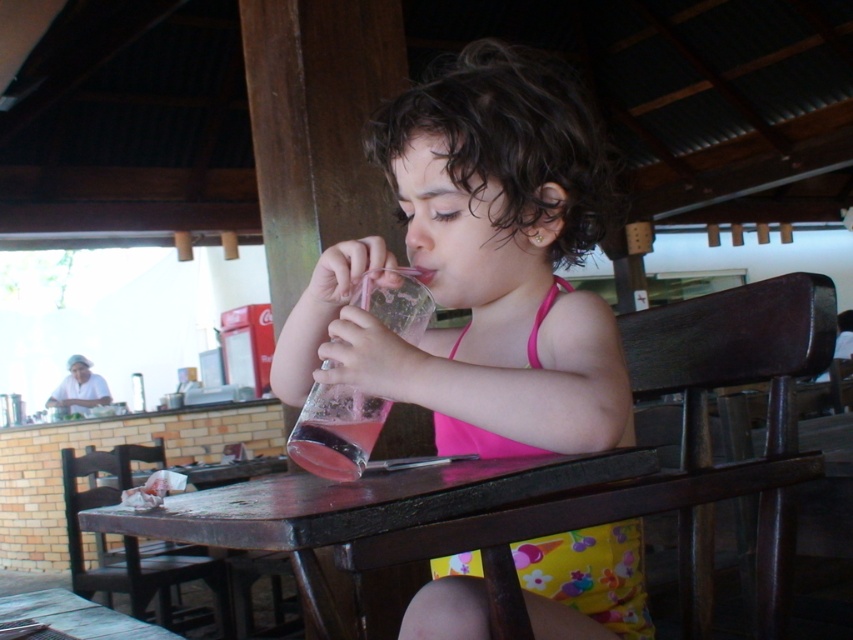
Question: Does pink matte swimsuit at center have a larger size compared to wooden table at center?

Choices:
 (A) yes
 (B) no

Answer: (A)

Question: Is wooden table at center positioned in front of wooden table at lower left?

Choices:
 (A) no
 (B) yes

Answer: (B)

Question: Does wooden table at center appear over wooden table at lower left?

Choices:
 (A) no
 (B) yes

Answer: (B)

Question: Which point appears closest to the camera in this image?

Choices:
 (A) (343, 538)
 (B) (358, 260)
 (C) (109, 636)

Answer: (A)

Question: Which object appears closest to the camera in this image?

Choices:
 (A) wooden table at center
 (B) wooden table at lower left

Answer: (A)

Question: Which object is positioned closest to the pink matte swimsuit at center?

Choices:
 (A) wooden table at center
 (B) wooden table at lower left

Answer: (A)